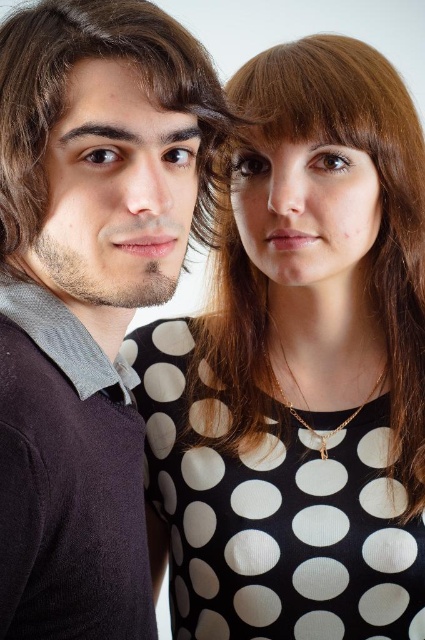
Who is positioned more to the right, brown silky hair at upper right or brown matte hair at left?

Positioned to the right is brown silky hair at upper right.

The width and height of the screenshot is (425, 640). Describe the element at coordinates (377, 195) in the screenshot. I see `brown silky hair at upper right` at that location.

At what (x,y) coordinates should I click in order to perform the action: click on brown silky hair at upper right. Please return your answer as a coordinate pair (x, y). Looking at the image, I should click on (377, 195).